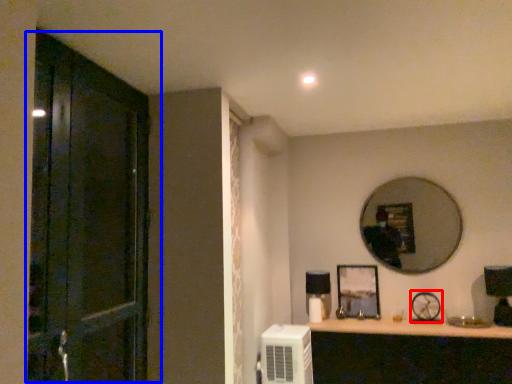
Question: Which object is closer to the camera taking this photo, oval (highlighted by a red box) or door (highlighted by a blue box)?

Choices:
 (A) oval
 (B) door

Answer: (B)